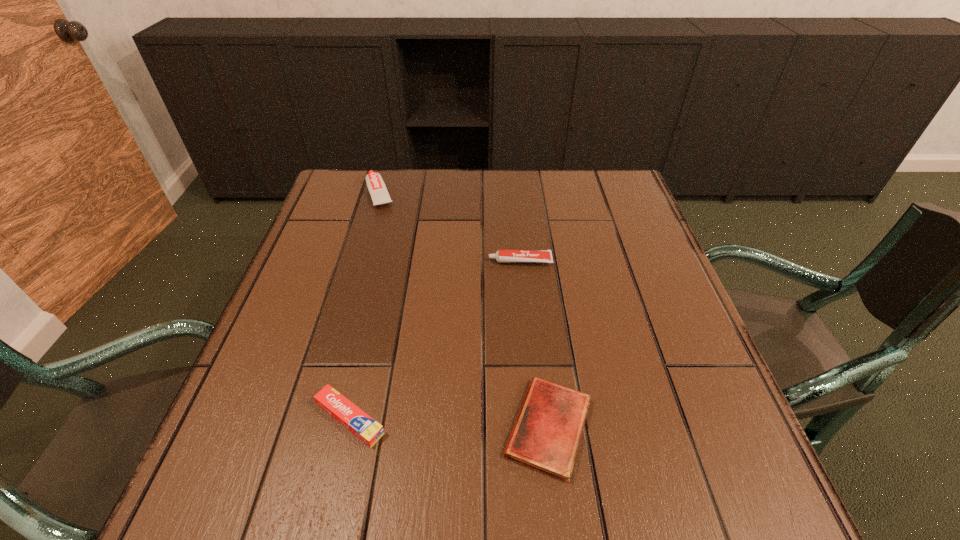
I want to click on free space between the shortest toothpaste and the tallest object, so click(x=365, y=306).

At what (x,y) coordinates should I click in order to perform the action: click on free spot between the tallest toothpaste and the shortest object. Please return your answer as a coordinate pair (x, y). The image size is (960, 540). Looking at the image, I should click on (465, 310).

Choose which object is the third nearest neighbor to the shortest object. Please provide its 2D coordinates. Your answer should be formatted as a tuple, i.e. [(x, y)], where the tuple contains the x and y coordinates of a point satisfying the conditions above.

[(376, 186)]

Find the location of a particular element. object that is the second closest one to the shortest object is located at coordinates (502, 256).

Point out which toothpaste is positioned as the nearest to the second tallest toothpaste. Please provide its 2D coordinates. Your answer should be formatted as a tuple, i.e. [(x, y)], where the tuple contains the x and y coordinates of a point satisfying the conditions above.

[(376, 186)]

Find the location of a particular element. The width and height of the screenshot is (960, 540). toothpaste that is the closest to the second farthest object is located at coordinates (376, 186).

Identify the location of free space in the image that satisfies the following two spatial constraints: 1. on the front side of the diary; 2. on the left side of the farthest object. (312, 427).

Locate an element on the screen. vacant space that satisfies the following two spatial constraints: 1. on the front side of the third tallest object; 2. on the left side of the diary is located at coordinates (348, 427).